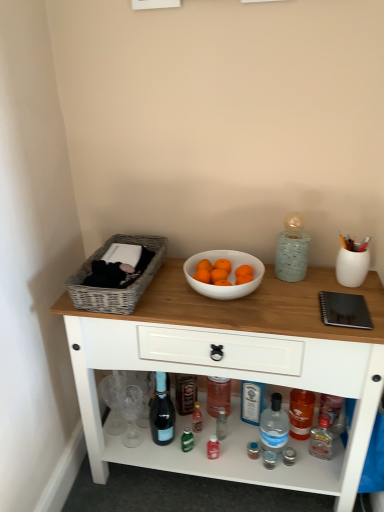
Question: Is wooden table at center placed right next to transparent plastic bottle at lower center, placed as the first bottle when sorted from right to left?

Choices:
 (A) no
 (B) yes

Answer: (A)

Question: Is wooden table at center aimed at transparent plastic bottle at lower center, placed as the first bottle when sorted from right to left?

Choices:
 (A) no
 (B) yes

Answer: (B)

Question: Is wooden table at center positioned in front of transparent plastic bottle at lower center, which ranks as the second bottle in left-to-right order?

Choices:
 (A) yes
 (B) no

Answer: (A)

Question: Is wooden table at center further to the viewer compared to transparent plastic bottle at lower center, placed as the first bottle when sorted from right to left?

Choices:
 (A) yes
 (B) no

Answer: (B)

Question: From a real-world perspective, does wooden table at center stand above transparent plastic bottle at lower center, placed as the first bottle when sorted from right to left?

Choices:
 (A) yes
 (B) no

Answer: (A)

Question: Is matte glass bottle at center, placed as the 1th bottle when sorted from left to right, wider or thinner than white glossy bowl at center?

Choices:
 (A) wide
 (B) thin

Answer: (B)

Question: From the image's perspective, is matte glass bottle at center, placed as the 1th bottle when sorted from left to right, located above or below white glossy bowl at center?

Choices:
 (A) below
 (B) above

Answer: (A)

Question: Is point (155, 417) closer or farther from the camera than point (261, 267)?

Choices:
 (A) closer
 (B) farther

Answer: (B)

Question: In terms of height, does matte glass bottle at center, which is the 2th bottle from right to left, look taller or shorter compared to white glossy bowl at center?

Choices:
 (A) short
 (B) tall

Answer: (B)

Question: Is point (251, 285) closer or farther from the camera than point (276, 425)?

Choices:
 (A) farther
 (B) closer

Answer: (B)

Question: From a real-world perspective, is white glossy bowl at center above or below transparent plastic bottle at lower center, which ranks as the second bottle in left-to-right order?

Choices:
 (A) above
 (B) below

Answer: (A)

Question: Based on their positions, is white glossy bowl at center located to the left or right of transparent plastic bottle at lower center, placed as the first bottle when sorted from right to left?

Choices:
 (A) left
 (B) right

Answer: (A)

Question: Is white glossy bowl at center in front of or behind transparent plastic bottle at lower center, placed as the first bottle when sorted from right to left, in the image?

Choices:
 (A) front
 (B) behind

Answer: (A)

Question: Is matte glass bottle at center, placed as the 1th bottle when sorted from left to right, spatially inside woven gray basket at left, or outside of it?

Choices:
 (A) outside
 (B) inside

Answer: (A)

Question: From the image's perspective, is matte glass bottle at center, which is the 2th bottle from right to left, located above or below woven gray basket at left?

Choices:
 (A) below
 (B) above

Answer: (A)